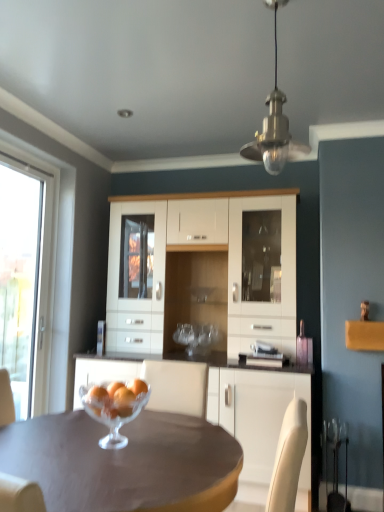
Question: Is white glossy cabinet at center completely or partially outside of metallic brass pendant light at upper center?

Choices:
 (A) no
 (B) yes

Answer: (B)

Question: Can you confirm if white glossy cabinet at center is shorter than metallic brass pendant light at upper center?

Choices:
 (A) yes
 (B) no

Answer: (A)

Question: Is white glossy cabinet at center closer to the viewer compared to metallic brass pendant light at upper center?

Choices:
 (A) no
 (B) yes

Answer: (B)

Question: Is white glossy cabinet at center to the right of metallic brass pendant light at upper center from the viewer's perspective?

Choices:
 (A) no
 (B) yes

Answer: (A)

Question: Is white glossy cabinet at center wider than metallic brass pendant light at upper center?

Choices:
 (A) no
 (B) yes

Answer: (B)

Question: In terms of height, does orange matte glass bowl at center look taller or shorter compared to transparent glass window at left?

Choices:
 (A) short
 (B) tall

Answer: (A)

Question: Based on their sizes in the image, would you say orange matte glass bowl at center is bigger or smaller than transparent glass window at left?

Choices:
 (A) big
 (B) small

Answer: (B)

Question: Does point [x=125, y=415] appear closer or farther from the camera than point [x=36, y=207]?

Choices:
 (A) farther
 (B) closer

Answer: (B)

Question: From a real-world perspective, is orange matte glass bowl at center physically located above or below transparent glass window at left?

Choices:
 (A) below
 (B) above

Answer: (A)

Question: From the image's perspective, is transparent glass window at left positioned above or below orange matte glass bowl at center?

Choices:
 (A) above
 (B) below

Answer: (A)

Question: Is transparent glass window at left taller or shorter than orange matte glass bowl at center?

Choices:
 (A) tall
 (B) short

Answer: (A)

Question: Is point (3, 206) closer or farther from the camera than point (115, 406)?

Choices:
 (A) closer
 (B) farther

Answer: (B)

Question: Considering the positions of transparent glass window at left and orange matte glass bowl at center in the image, is transparent glass window at left wider or thinner than orange matte glass bowl at center?

Choices:
 (A) wide
 (B) thin

Answer: (B)

Question: Considering the positions of orange matte glass bowl at center and matte brown table at center in the image, is orange matte glass bowl at center wider or thinner than matte brown table at center?

Choices:
 (A) wide
 (B) thin

Answer: (B)

Question: Is point (117, 412) closer or farther from the camera than point (92, 508)?

Choices:
 (A) farther
 (B) closer

Answer: (A)